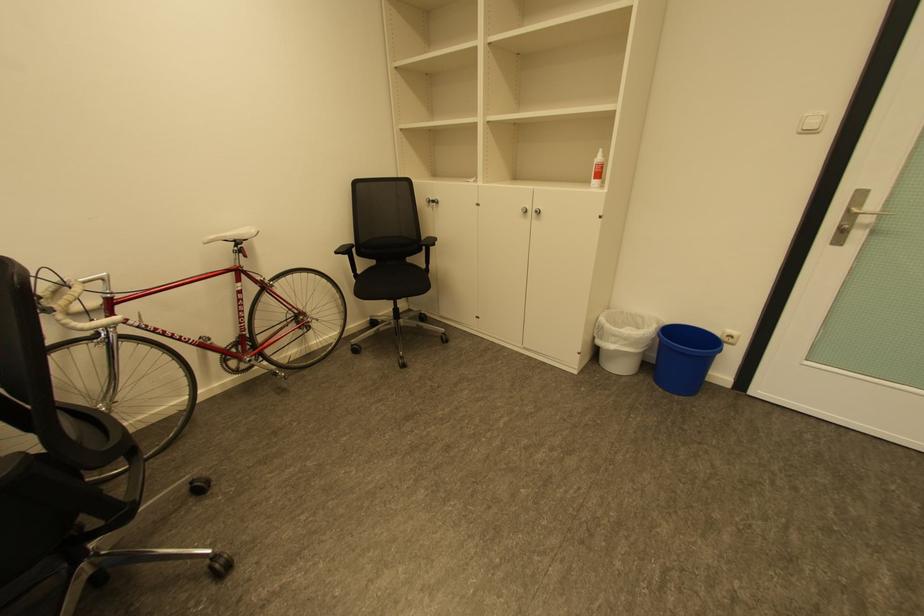
At what (x,y) coordinates should I click in order to perform the action: click on bicycle handlebars. Please return your answer as a coordinate pair (x, y). Looking at the image, I should click on (73, 307).